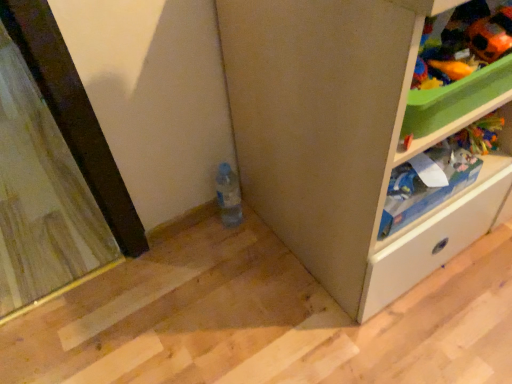
Locate an element on the screen. The height and width of the screenshot is (384, 512). vacant region to the left of translucent plastic bottle at lower center is located at coordinates (184, 240).